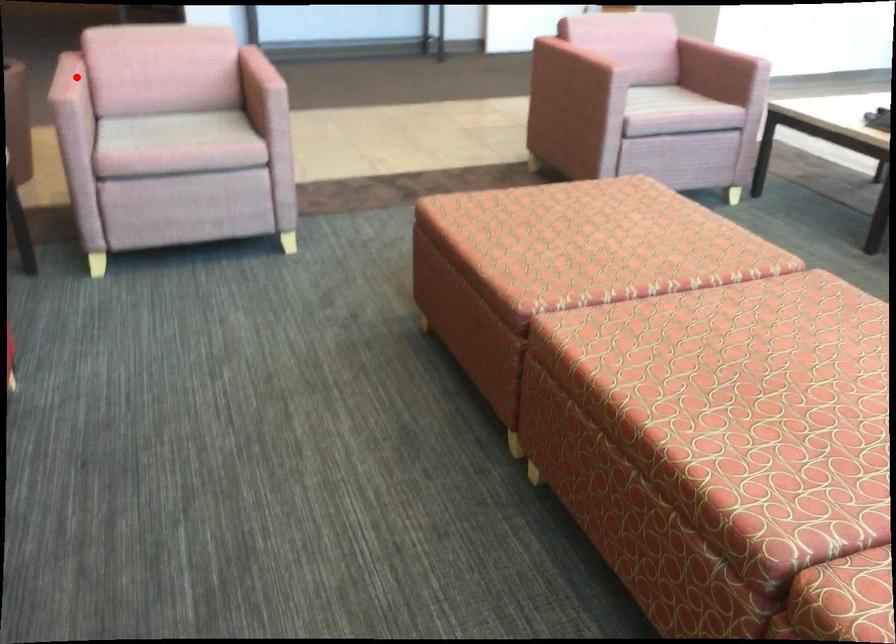
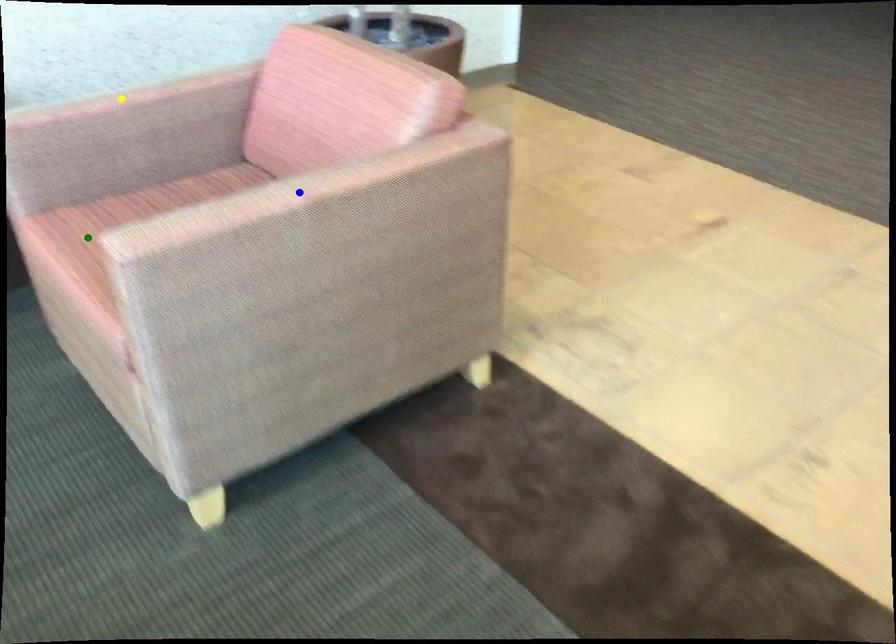
Question: I am providing you with two images of the same scene from different viewpoints. A red point is marked on the first image. You are given multiple points on the second image. Which mark in image 2 goes with the point in image 1?

Choices:
 (A) yellow point
 (B) blue point
 (C) green point

Answer: (A)